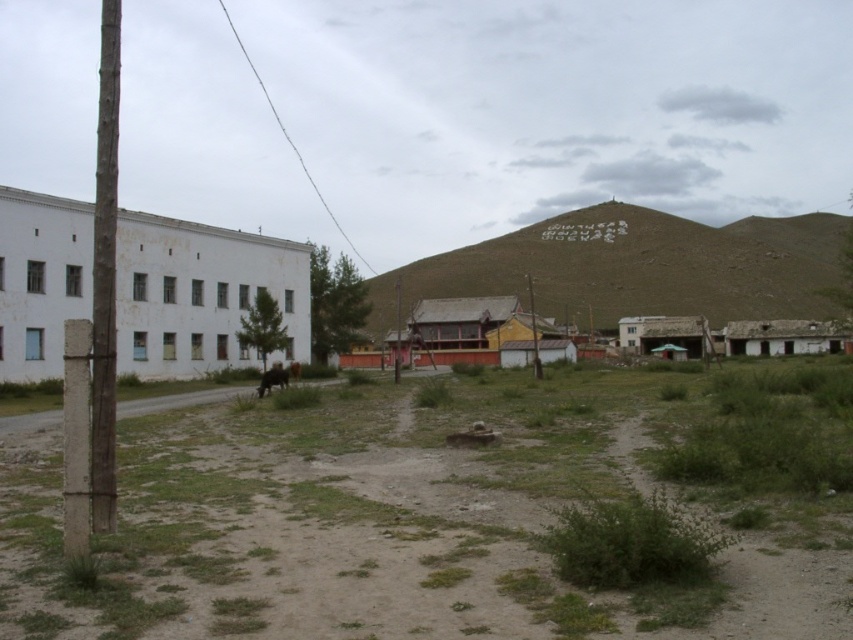
Looking at this image, you are standing on the dirt road and see the green grassy hillside at center and the brown furry dog at center. Which object is higher in the image?

The green grassy hillside at center is above the brown furry dog at center in the image.

You are a hiker trying to navigate through this rural area. You see the green grassy hillside at center and the brown wooden pole at left. Which of these two features takes up more visual space in the image?

The brown wooden pole at left occupies more visual space than the green grassy hillside at center according to the description.